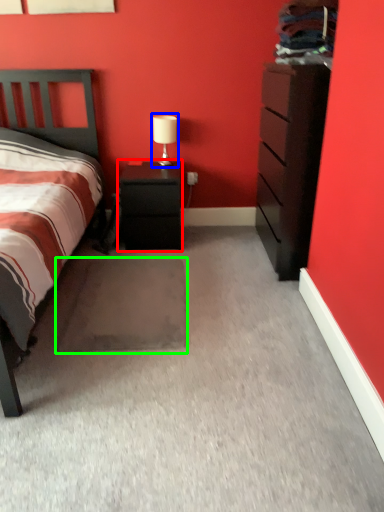
Question: Based on their relative distances, which object is nearer to nightstand (highlighted by a red box)? Choose from table lamp (highlighted by a blue box) and footrest (highlighted by a green box).

Choices:
 (A) table lamp
 (B) footrest

Answer: (A)